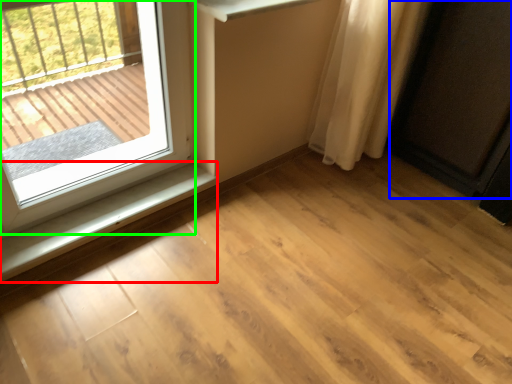
Question: Which object is the farthest from window sill (highlighted by a red box)? Choose among these: screen door (highlighted by a blue box) or window (highlighted by a green box).

Choices:
 (A) screen door
 (B) window

Answer: (A)